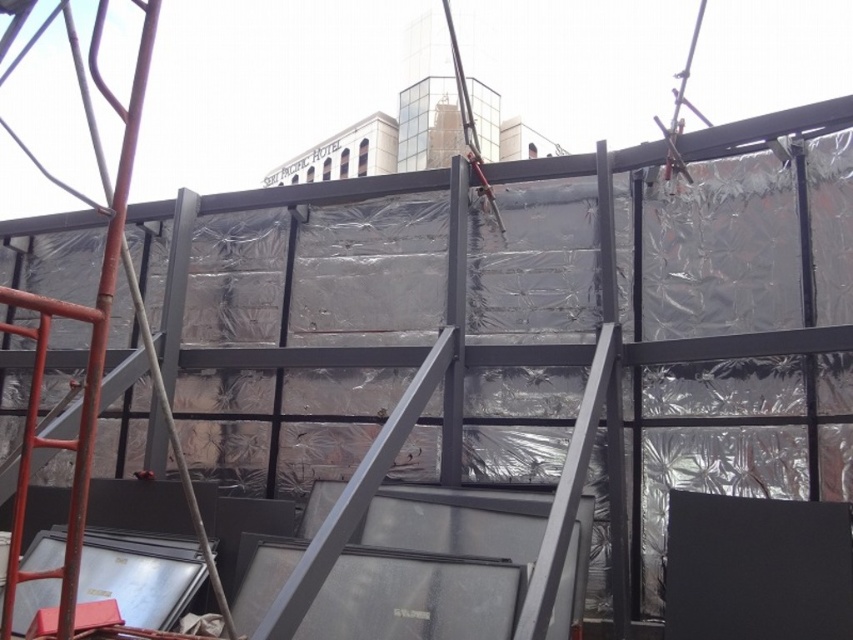
Who is positioned more to the left, red metal ladder at left or metal at center?

red metal ladder at left is more to the left.

In the scene shown: Measure the distance between point (x=113, y=253) and camera.

The distance of point (x=113, y=253) from camera is 7.06 feet.

You are a GUI agent. You are given a task and a screenshot of the screen. Output one action in this format:
    pyautogui.click(x=<x>, y=<y>)
    Task: Click on the red metal ladder at left
    The width and height of the screenshot is (853, 640).
    Given the screenshot: What is the action you would take?
    pyautogui.click(x=88, y=348)